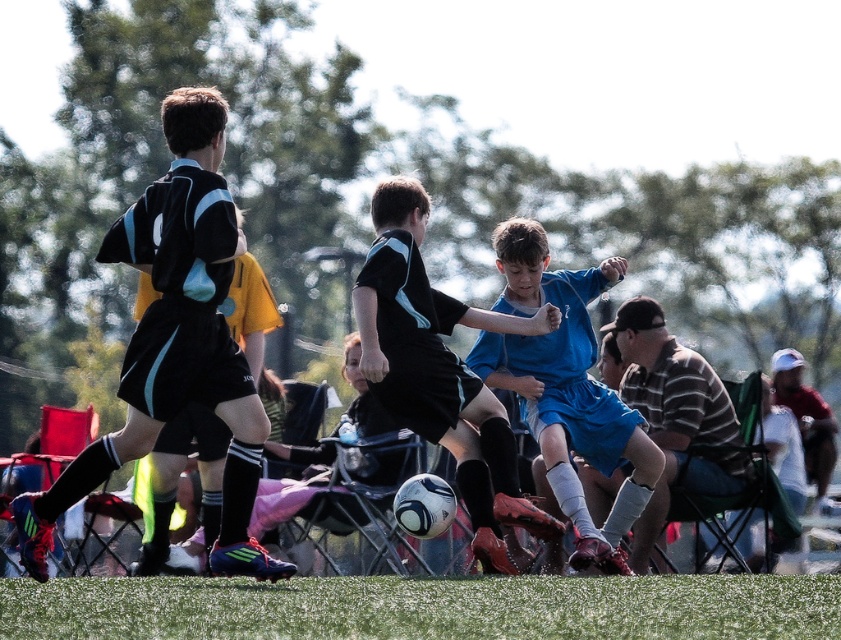
Which is in front, point (283, 582) or point (173, 177)?

Positioned in front is point (173, 177).

The image size is (841, 640). Identify the location of green artificial turf at center. (424, 608).

In the scene shown: Who is lower down, black matte soccer jersey at center or reddish-brown fabric cap at upper right?

Positioned lower is reddish-brown fabric cap at upper right.

Between black matte soccer jersey at center and reddish-brown fabric cap at upper right, which one is positioned higher?

black matte soccer jersey at center

Which is behind, point (247, 515) or point (797, 371)?

The point (797, 371) is more distant.

This screenshot has width=841, height=640. What are the coordinates of `black matte soccer jersey at center` in the screenshot? It's located at (176, 342).

Is point (276, 586) positioned before point (461, 368)?

Yes, it is in front of point (461, 368).

This screenshot has height=640, width=841. Describe the element at coordinates (424, 608) in the screenshot. I see `green artificial turf at center` at that location.

Identify the location of green artificial turf at center. Image resolution: width=841 pixels, height=640 pixels. (424, 608).